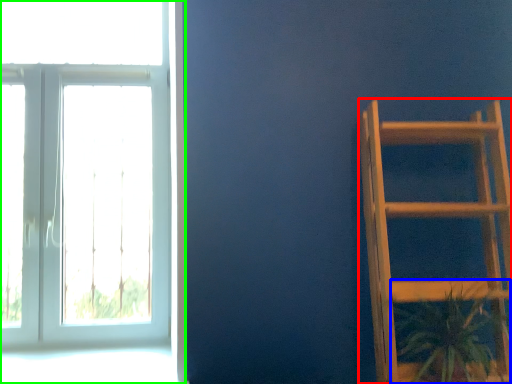
Question: Which object is the closest to the furniture (highlighted by a red box)? Choose among these: houseplant (highlighted by a blue box) or window (highlighted by a green box).

Choices:
 (A) houseplant
 (B) window

Answer: (A)